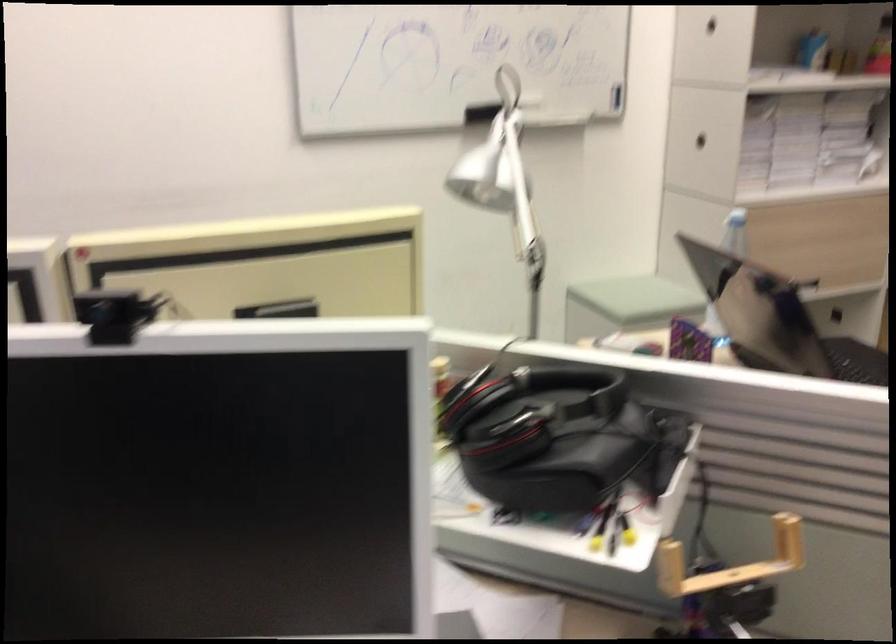
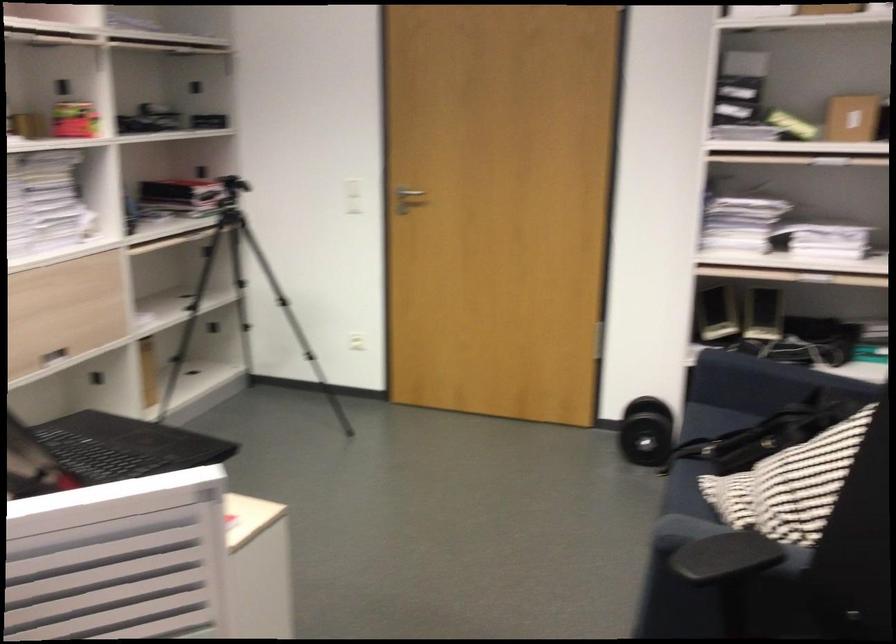
Question: The camera is either moving clockwise (left) or counter-clockwise (right) around the object. The first image is from the beginning of the video and the second image is from the end. Is the camera moving left or right when shooting the video?

Choices:
 (A) Left
 (B) Right

Answer: (A)